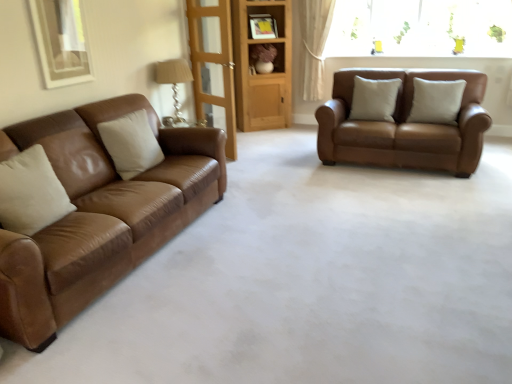
Question: Does white leather pillow at center, the second pillow from the front, have a larger size compared to white leather pillow at left, which is counted as the first pillow, starting from the left?

Choices:
 (A) yes
 (B) no

Answer: (A)

Question: From a real-world perspective, does white leather pillow at center, the second pillow from the front, sit lower than white leather pillow at left, the 3th pillow when ordered from right to left?

Choices:
 (A) no
 (B) yes

Answer: (A)

Question: Is white leather pillow at center, the second pillow from the front, thinner than white leather pillow at left, arranged as the 1th pillow when viewed from the front?

Choices:
 (A) no
 (B) yes

Answer: (A)

Question: Is white leather pillow at center, the second pillow from the front, located outside white leather pillow at left, which is the third pillow in back-to-front order?

Choices:
 (A) no
 (B) yes

Answer: (B)

Question: Does white leather pillow at center, the second pillow from the front, come in front of white leather pillow at left, the 3th pillow when ordered from right to left?

Choices:
 (A) no
 (B) yes

Answer: (A)

Question: From the image's perspective, is white leather pillow at center, acting as the first pillow starting from the right, positioned above or below matte brown shelf at center?

Choices:
 (A) above
 (B) below

Answer: (B)

Question: Considering the positions of white leather pillow at center, acting as the first pillow starting from the right, and matte brown shelf at center in the image, is white leather pillow at center, acting as the first pillow starting from the right, taller or shorter than matte brown shelf at center?

Choices:
 (A) short
 (B) tall

Answer: (B)

Question: Relative to matte brown shelf at center, is white leather pillow at center, the 2th pillow in the back-to-front sequence, in front or behind?

Choices:
 (A) behind
 (B) front

Answer: (B)

Question: From a real-world perspective, is white leather pillow at center, acting as the first pillow starting from the right, physically located above or below matte brown shelf at center?

Choices:
 (A) above
 (B) below

Answer: (B)

Question: From the image's perspective, is transparent glass door at center located above or below matte brown shelf at center?

Choices:
 (A) below
 (B) above

Answer: (A)

Question: Would you say transparent glass door at center is inside or outside matte brown shelf at center?

Choices:
 (A) inside
 (B) outside

Answer: (B)

Question: Considering the relative positions of transparent glass door at center and matte brown shelf at center in the image provided, is transparent glass door at center to the left or to the right of matte brown shelf at center?

Choices:
 (A) left
 (B) right

Answer: (A)

Question: Relative to matte brown shelf at center, is transparent glass door at center in front or behind?

Choices:
 (A) behind
 (B) front

Answer: (B)

Question: Is white leather pillow at center, the 2th pillow in the back-to-front sequence, situated inside transparent glass door at center or outside?

Choices:
 (A) outside
 (B) inside

Answer: (A)

Question: In terms of width, does white leather pillow at center, the 2th pillow in the back-to-front sequence, look wider or thinner when compared to transparent glass door at center?

Choices:
 (A) wide
 (B) thin

Answer: (A)